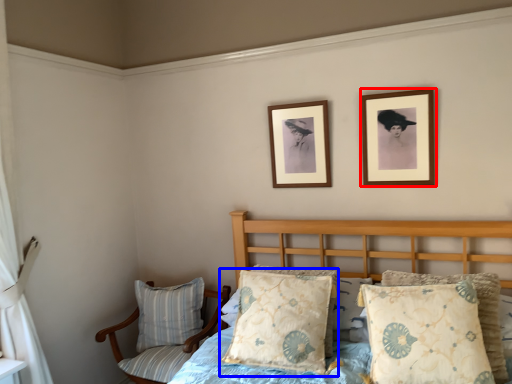
Question: Which point is closer to the camera, picture frame (highlighted by a red box) or pillow (highlighted by a blue box)?

Choices:
 (A) picture frame
 (B) pillow

Answer: (B)